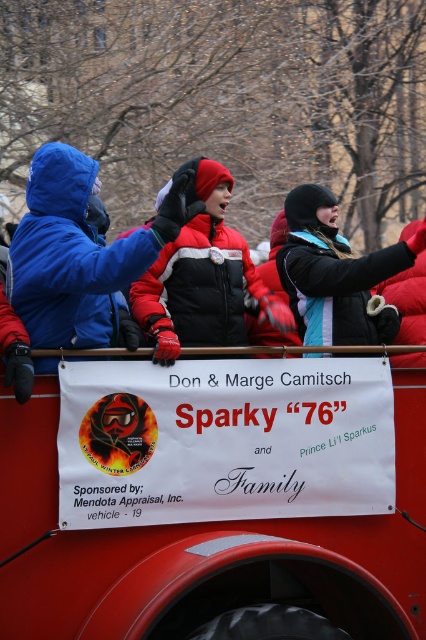
Question: Which point is closer to the camera?

Choices:
 (A) matte blue jacket at left
 (B) black fuzzy hat at upper center

Answer: (A)

Question: Can you confirm if red and white jacket at center is positioned to the left of black fuzzy hat at upper center?

Choices:
 (A) no
 (B) yes

Answer: (B)

Question: Is blue fleece jacket at left to the left of black fuzzy hat at upper center from the viewer's perspective?

Choices:
 (A) no
 (B) yes

Answer: (B)

Question: Among these points, which one is farthest from the camera?

Choices:
 (A) tap(291, 250)
 (B) tap(11, 259)

Answer: (A)

Question: Is blue fleece jacket at left below black fuzzy hat at upper center?

Choices:
 (A) no
 (B) yes

Answer: (B)

Question: Estimate the real-world distances between objects in this image. Which object is closer to the matte blue jacket at left?

Choices:
 (A) black fuzzy hat at upper center
 (B) blue fleece jacket at left

Answer: (B)